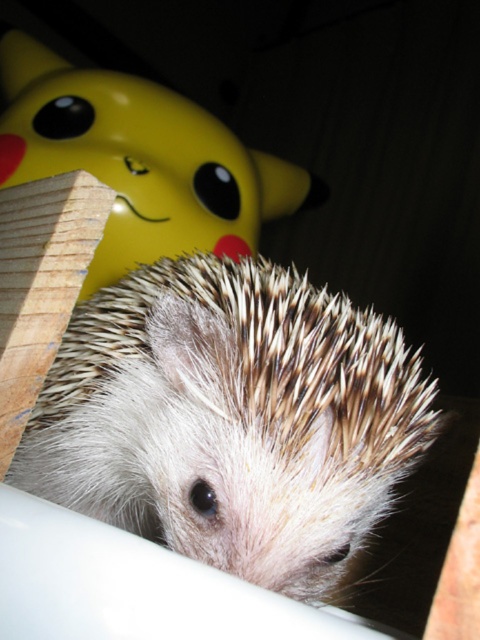
Question: Which of the following is the closest to the observer?

Choices:
 (A) (110, 122)
 (B) (132, 364)

Answer: (B)

Question: Which object is farther from the camera taking this photo?

Choices:
 (A) yellow matte pikachu at upper left
 (B) white spiny hedgehog at center

Answer: (A)

Question: Is white spiny hedgehog at center positioned at the back of yellow matte pikachu at upper left?

Choices:
 (A) no
 (B) yes

Answer: (A)

Question: Which of the following is the closest to the observer?

Choices:
 (A) (157, 172)
 (B) (201, 496)

Answer: (B)

Question: From the image, what is the correct spatial relationship of white spiny hedgehog at center in relation to yellow matte pikachu at upper left?

Choices:
 (A) above
 (B) below

Answer: (B)

Question: From the image, what is the correct spatial relationship of white spiny hedgehog at center in relation to yellow matte pikachu at upper left?

Choices:
 (A) below
 (B) above

Answer: (A)